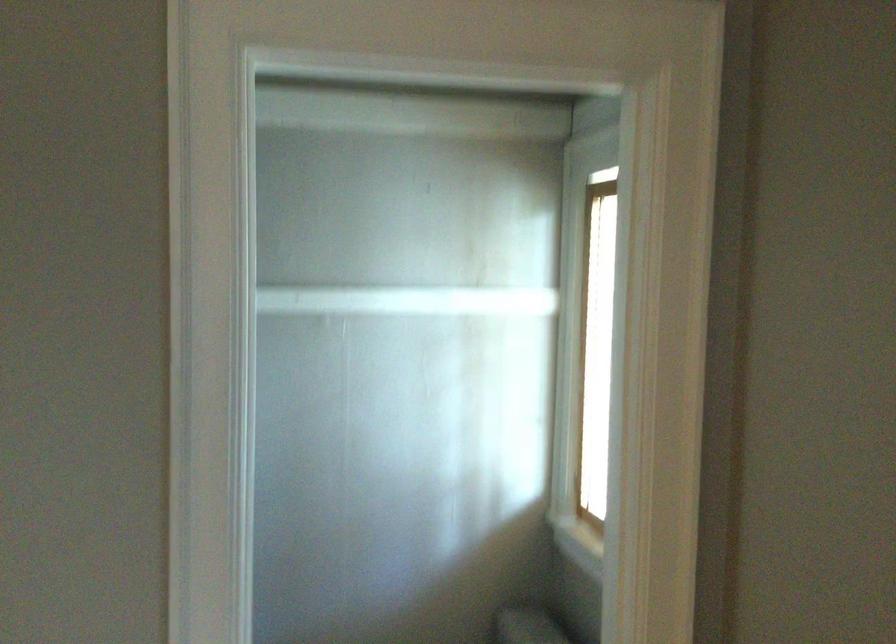
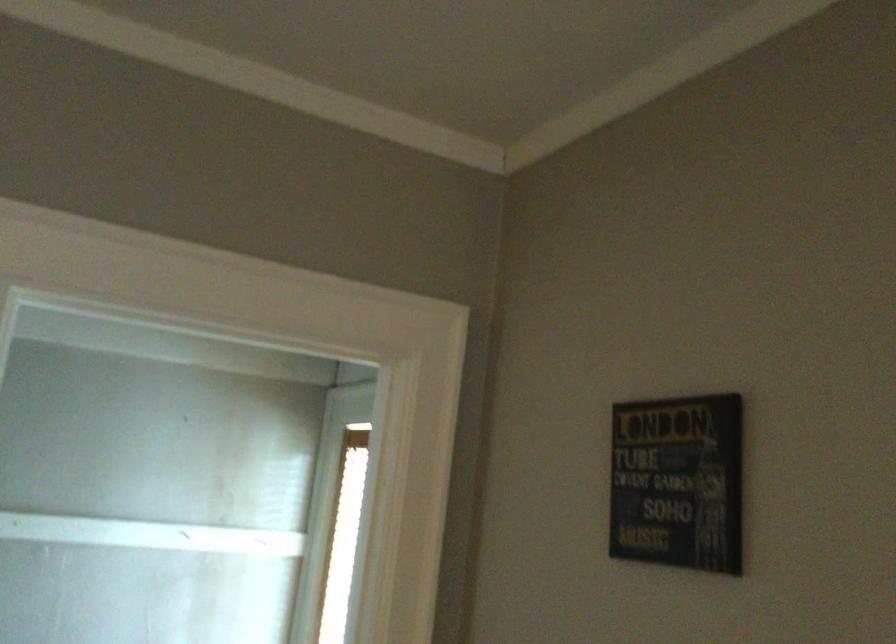
How did the camera likely rotate?

The camera's rotation is toward right-up.